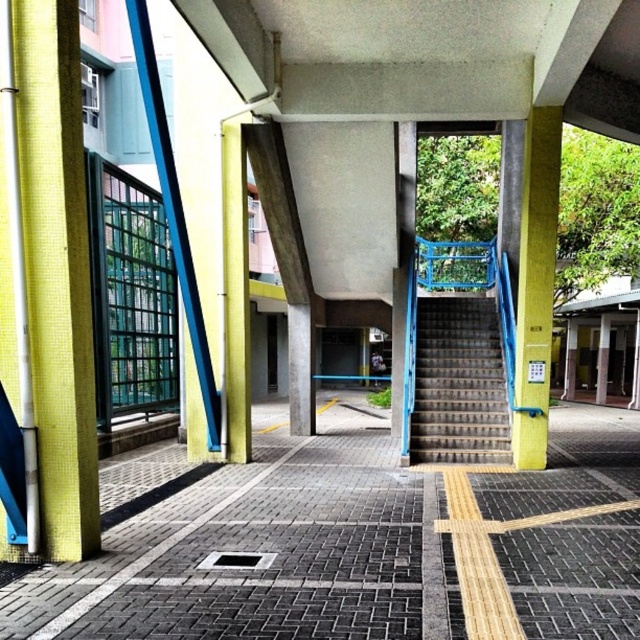
Question: Considering the real-world distances, which object is farthest from the yellow mosaic tile pillar at left?

Choices:
 (A) yellow mosaic tile pillar at center
 (B) yellow textured pillar at right
 (C) metallic blue staircase at right

Answer: (C)

Question: Can you confirm if yellow textured pillar at right is positioned to the right of yellow mosaic tile pillar at center?

Choices:
 (A) yes
 (B) no

Answer: (A)

Question: Which point appears closest to the camera in this image?

Choices:
 (A) (538, 461)
 (B) (488, 390)
 (C) (48, 456)
 (D) (240, 246)

Answer: (C)

Question: Which object appears closest to the camera in this image?

Choices:
 (A) yellow mosaic tile pillar at left
 (B) yellow mosaic tile pillar at center
 (C) metallic blue staircase at right

Answer: (A)

Question: Is yellow textured pillar at right thinner than yellow mosaic tile pillar at center?

Choices:
 (A) no
 (B) yes

Answer: (A)

Question: Is yellow mosaic tile pillar at left wider than yellow textured pillar at right?

Choices:
 (A) no
 (B) yes

Answer: (B)